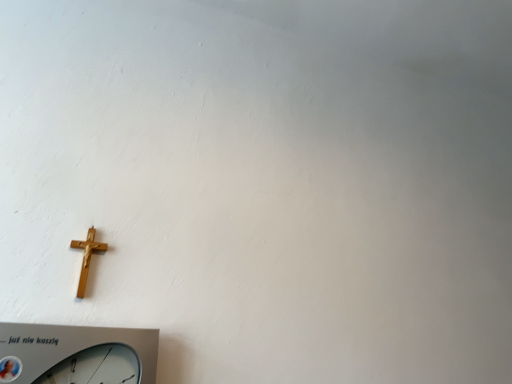
Question: Looking at the image, does gold wooden crucifix at lower left seem bigger or smaller compared to silver metallic wall clock at lower left?

Choices:
 (A) small
 (B) big

Answer: (A)

Question: Is point (84, 281) closer or farther from the camera than point (126, 362)?

Choices:
 (A) farther
 (B) closer

Answer: (A)

Question: From the image's perspective, is gold wooden crucifix at lower left positioned above or below silver metallic wall clock at lower left?

Choices:
 (A) above
 (B) below

Answer: (A)

Question: Choose the correct answer: Is silver metallic wall clock at lower left inside gold wooden crucifix at lower left or outside it?

Choices:
 (A) inside
 (B) outside

Answer: (B)

Question: Based on their positions, is silver metallic wall clock at lower left located to the left or right of gold wooden crucifix at lower left?

Choices:
 (A) left
 (B) right

Answer: (B)

Question: Is point (82, 327) closer or farther from the camera than point (75, 294)?

Choices:
 (A) farther
 (B) closer

Answer: (B)

Question: From the image's perspective, relative to gold wooden crucifix at lower left, is silver metallic wall clock at lower left above or below?

Choices:
 (A) above
 (B) below

Answer: (B)